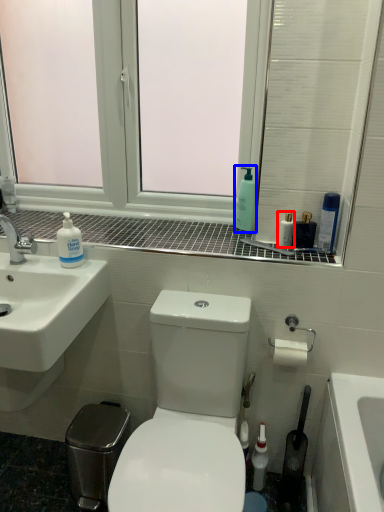
Question: Which point is further to the camera, mouthwash (highlighted by a red box) or soap dispenser (highlighted by a blue box)?

Choices:
 (A) mouthwash
 (B) soap dispenser

Answer: (B)